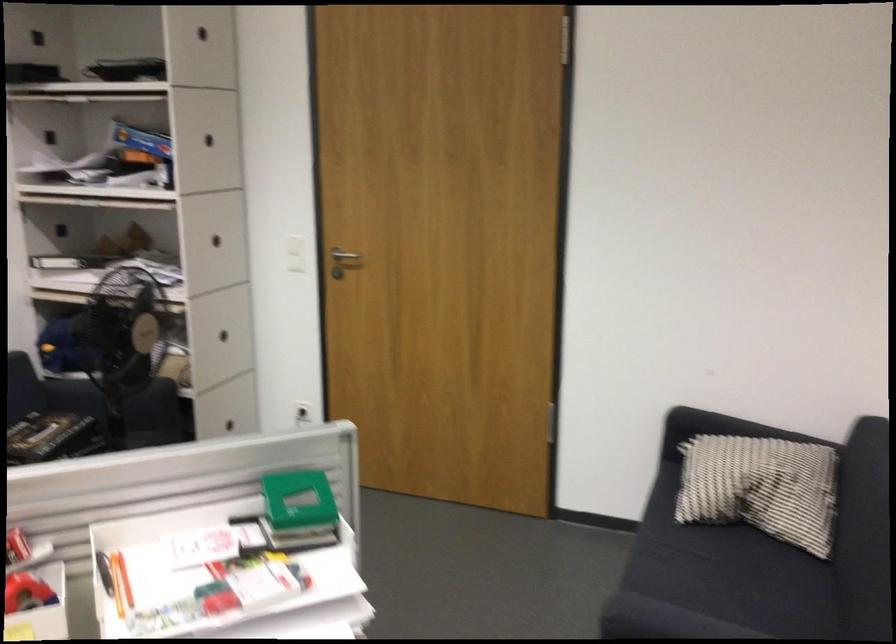
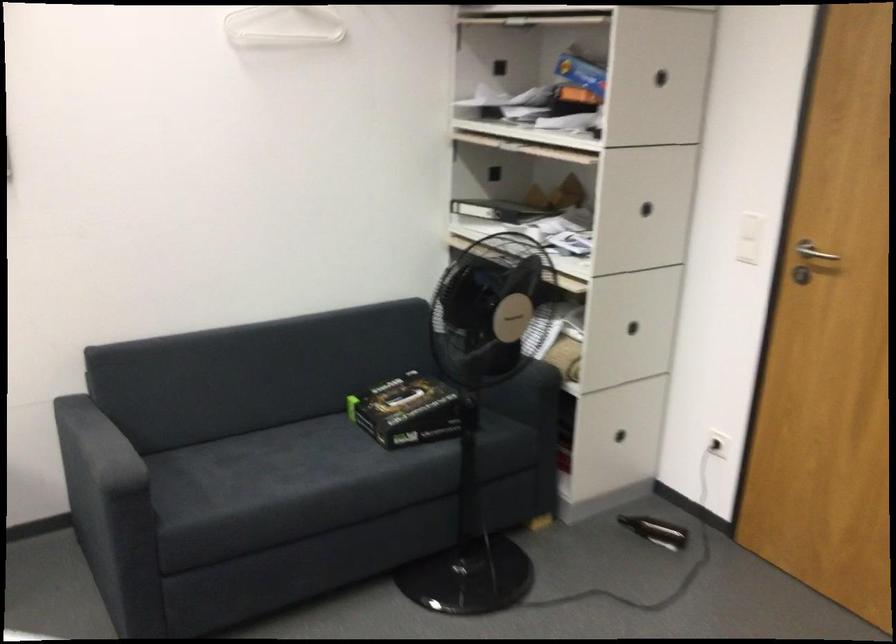
Question: Based on the continuous images, in which direction is the camera rotating? Reply with the corresponding letter.

Choices:
 (A) Left
 (B) Right
 (C) Up
 (D) Down

Answer: (A)